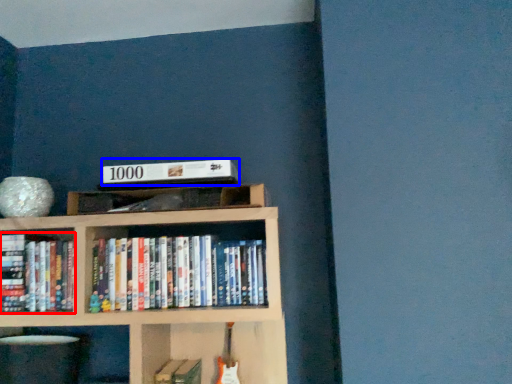
Question: Which object is closer to the camera taking this photo, book (highlighted by a red box) or paperback book (highlighted by a blue box)?

Choices:
 (A) book
 (B) paperback book

Answer: (B)